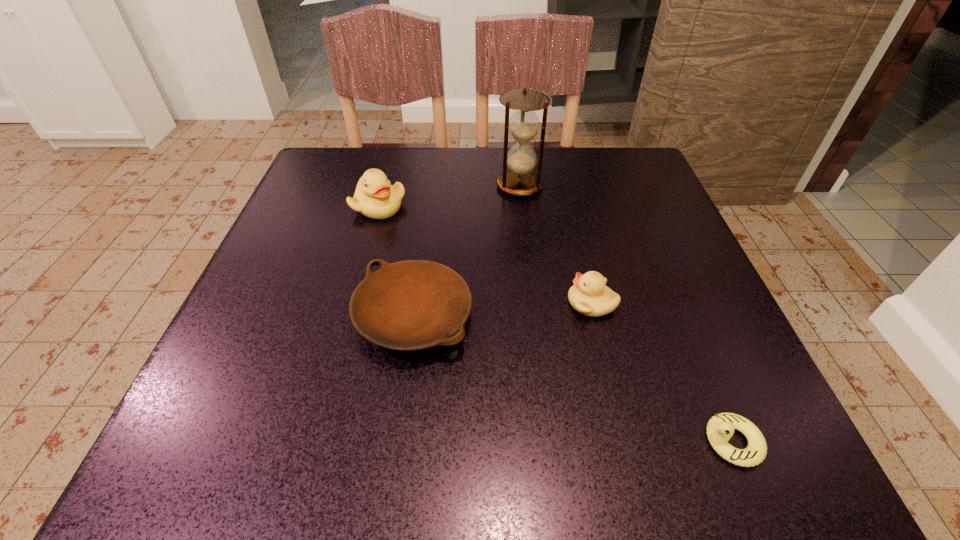
Identify which object is the third closest to the second duckling from left to right. Please provide its 2D coordinates. Your answer should be formatted as a tuple, i.e. [(x, y)], where the tuple contains the x and y coordinates of a point satisfying the conditions above.

[(524, 124)]

Locate which object is the closest to the third tallest object. Please provide its 2D coordinates. Your answer should be formatted as a tuple, i.e. [(x, y)], where the tuple contains the x and y coordinates of a point satisfying the conditions above.

[(409, 305)]

Where is `the third closest duckling to the plate`? the third closest duckling to the plate is located at coordinates click(x=720, y=428).

Identify which duckling is the second nearest to the tallest duckling. Please provide its 2D coordinates. Your answer should be formatted as a tuple, i.e. [(x, y)], where the tuple contains the x and y coordinates of a point satisfying the conditions above.

[(720, 428)]